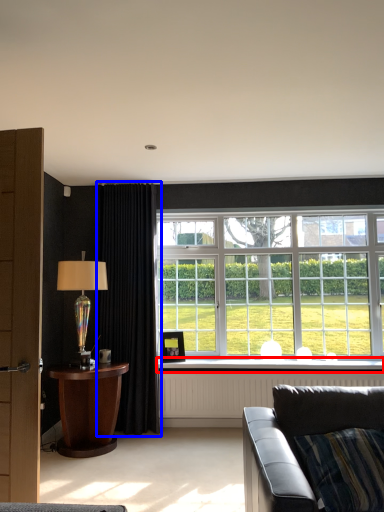
Question: Which point is closer to the camera, window sill (highlighted by a red box) or curtain (highlighted by a blue box)?

Choices:
 (A) window sill
 (B) curtain

Answer: (B)